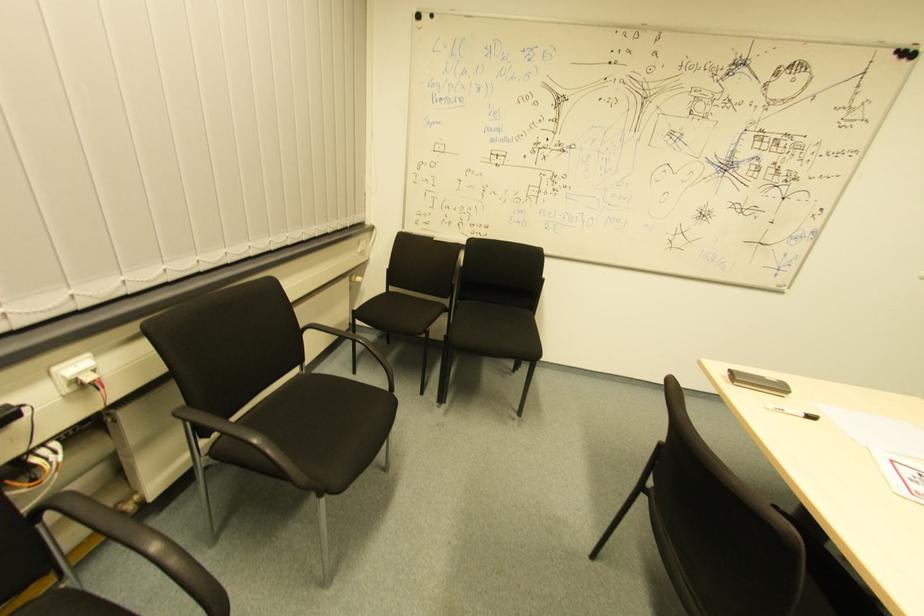
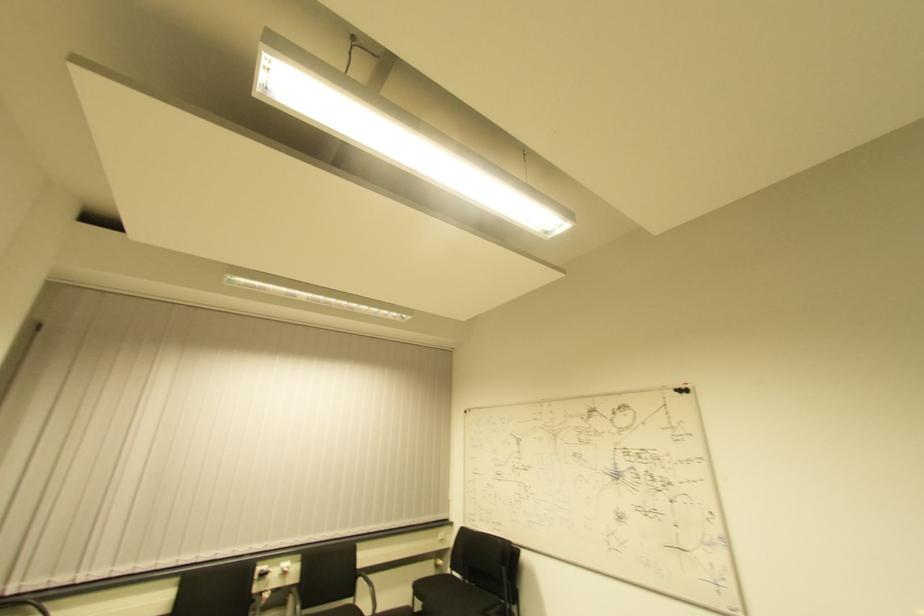
Locate, in the second image, the point that corresponds to point (391, 292) in the first image.

(454, 576)